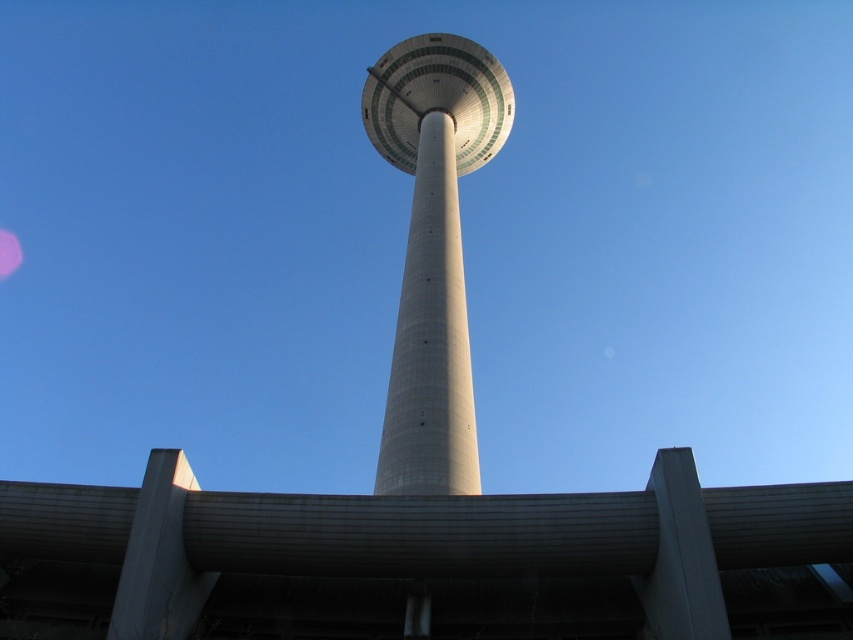
Question: Estimate the real-world distances between objects in this image. Which object is closer to the concrete at center?

Choices:
 (A) white concrete tower at center
 (B) smooth concrete tower at center

Answer: (A)

Question: Does white concrete tower at center appear over smooth concrete tower at center?

Choices:
 (A) no
 (B) yes

Answer: (A)

Question: Considering the relative positions of concrete at center and white concrete tower at center in the image provided, where is concrete at center located with respect to white concrete tower at center?

Choices:
 (A) left
 (B) right

Answer: (A)

Question: Which object is closer to the camera taking this photo?

Choices:
 (A) smooth concrete tower at center
 (B) concrete at center
 (C) white concrete tower at center

Answer: (B)

Question: Among these objects, which one is farthest from the camera?

Choices:
 (A) white concrete tower at center
 (B) smooth concrete tower at center

Answer: (B)

Question: In this image, where is white concrete tower at center located relative to smooth concrete tower at center?

Choices:
 (A) above
 (B) below

Answer: (B)